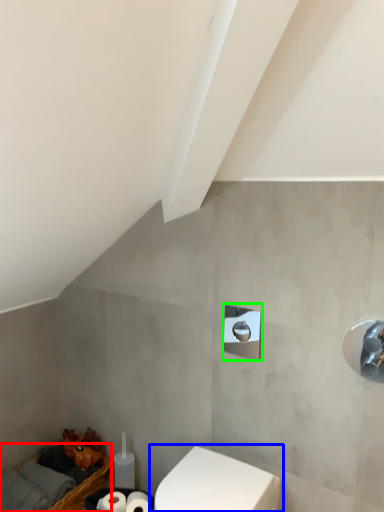
Question: Estimate the real-world distances between objects in this image. Which object is farther from basket (highlighted by a red box), toilet (highlighted by a blue box) or shower (highlighted by a green box)?

Choices:
 (A) toilet
 (B) shower

Answer: (B)